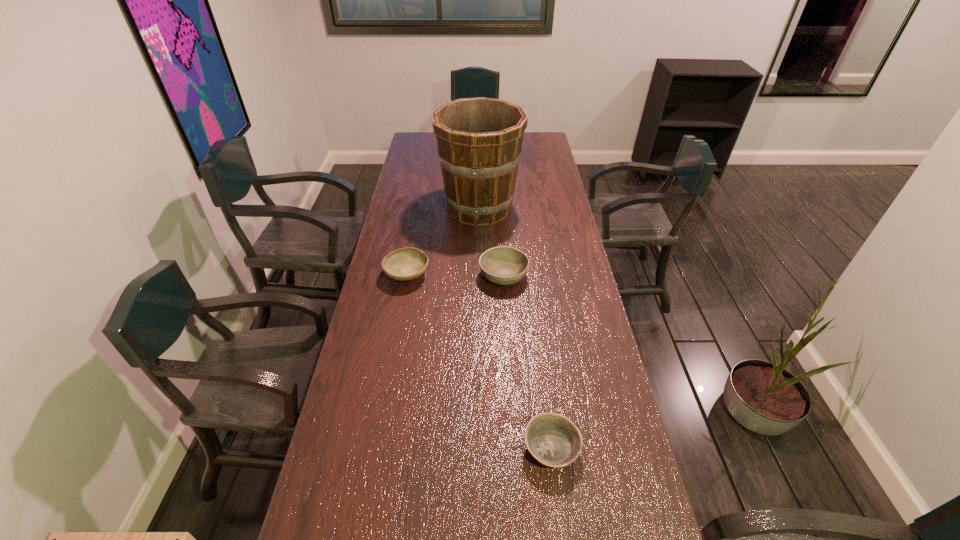
This screenshot has height=540, width=960. Identify the location of bucket. (479, 140).

Locate an element on the screen. the farthest object is located at coordinates (479, 140).

The height and width of the screenshot is (540, 960). I want to click on the leftmost bowl, so click(405, 264).

At what (x,y) coordinates should I click in order to perform the action: click on the nearest object. Please return your answer as a coordinate pair (x, y). The width and height of the screenshot is (960, 540). Looking at the image, I should click on (553, 440).

This screenshot has width=960, height=540. Find the location of `the shortest object`. the shortest object is located at coordinates coord(553,440).

You are a GUI agent. You are given a task and a screenshot of the screen. Output one action in this format:
    pyautogui.click(x=<x>, y=<y>)
    Task: Click on the free region located on the back of the bucket
    The width and height of the screenshot is (960, 540).
    Given the screenshot: What is the action you would take?
    pyautogui.click(x=479, y=170)

Where is `vacant space located on the right of the leftmost bowl`? The width and height of the screenshot is (960, 540). vacant space located on the right of the leftmost bowl is located at coordinates (460, 274).

At what (x,y) coordinates should I click in order to perform the action: click on free region located 0.260m on the left of the shortest object. Please return your answer as a coordinate pair (x, y). This screenshot has height=540, width=960. Looking at the image, I should click on (421, 448).

This screenshot has height=540, width=960. What are the coordinates of `object located in the left edge section of the desktop` in the screenshot? It's located at (405, 264).

Locate an element on the screen. This screenshot has width=960, height=540. object that is at the right edge is located at coordinates [x=553, y=440].